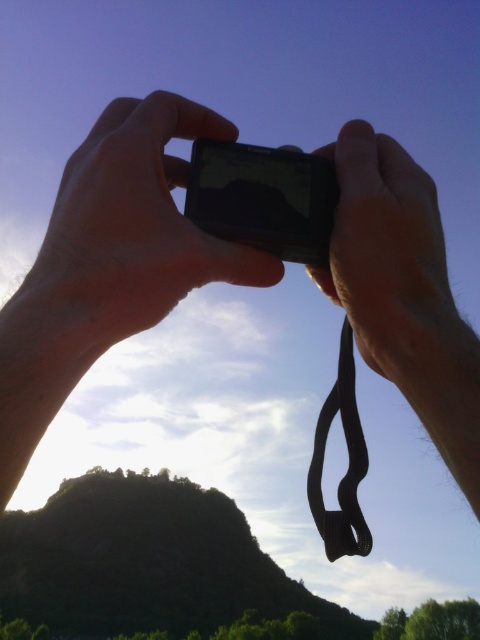
You are a photographer holding a matte black camera at center and a black glossy smartphone at center. You want to place them on a table so that the camera is not blocking the smartphone. Based on their current positions, which one should you move?

The matte black camera at center is above the black glossy smartphone at center. To prevent the camera from blocking the smartphone, you should move the matte black camera at center downward or the smartphone upward.

You are a photographer trying to choose between the matte black camera at center and the black glossy smartphone at center for a photography session. Considering their sizes, which one might be more cumbersome to carry around?

The matte black camera at center has a larger width than the black glossy smartphone at center, so it might be more cumbersome to carry around.